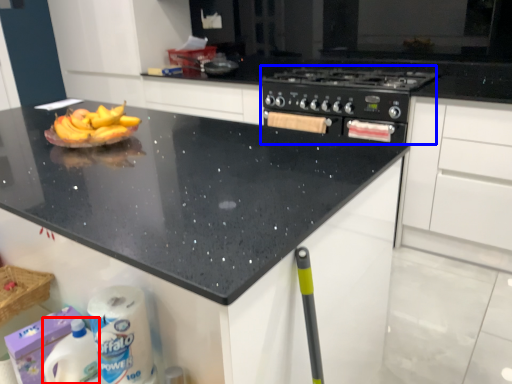
Question: Which point is closer to the camera, cleaning product (highlighted by a red box) or appliance (highlighted by a blue box)?

Choices:
 (A) cleaning product
 (B) appliance

Answer: (A)